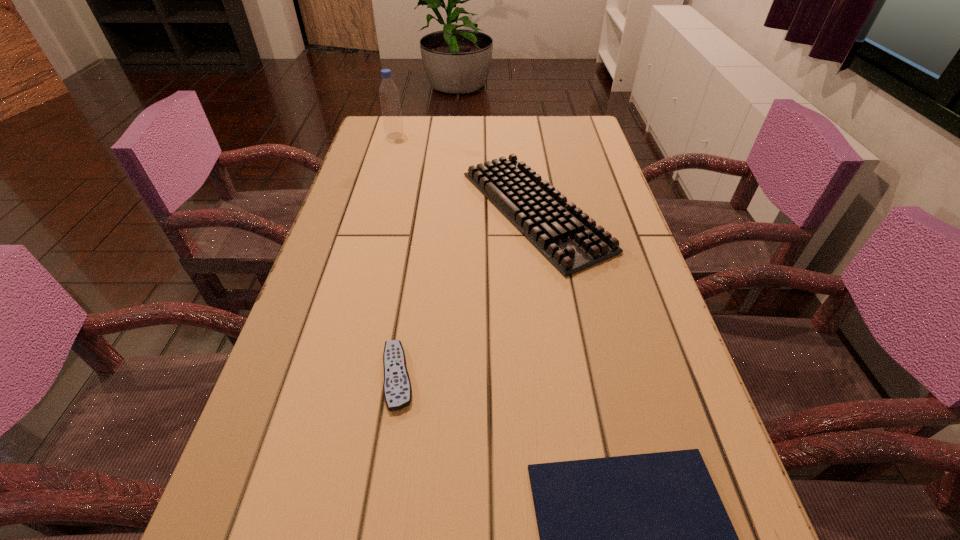
Identify the location of object at the left edge. This screenshot has height=540, width=960. (393, 125).

This screenshot has height=540, width=960. I want to click on object at the right edge, so click(565, 235).

Where is `object that is at the far left corner`? This screenshot has height=540, width=960. object that is at the far left corner is located at coordinates (393, 125).

In order to click on vacant region at the far edge of the desktop in this screenshot , I will do `click(490, 132)`.

In the image, there is a desktop. Where is `vacant space at the left edge`? The height and width of the screenshot is (540, 960). vacant space at the left edge is located at coordinates (360, 206).

The height and width of the screenshot is (540, 960). I want to click on vacant region at the right edge of the desktop, so click(564, 156).

Identify the location of free spot at the far left corner of the desktop. (372, 151).

Locate an element on the screen. The height and width of the screenshot is (540, 960). free space between the tallest object and the second object from left to right is located at coordinates (396, 256).

At what (x,y) coordinates should I click in order to perform the action: click on free space between the second tallest object and the second object from left to right. Please return your answer as a coordinate pair (x, y). Looking at the image, I should click on 467,293.

The image size is (960, 540). I want to click on object that is the third nearest to the nearest object, so [393, 125].